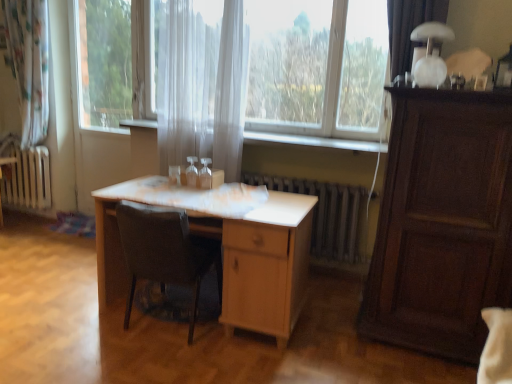
You are a GUI agent. You are given a task and a screenshot of the screen. Output one action in this format:
    pyautogui.click(x=<x>, y=<y>)
    Task: Click on the vacant space that is to the left of dark wood cabinet at right
    Image resolution: width=512 pixels, height=384 pixels.
    Given the screenshot: What is the action you would take?
    pyautogui.click(x=336, y=342)